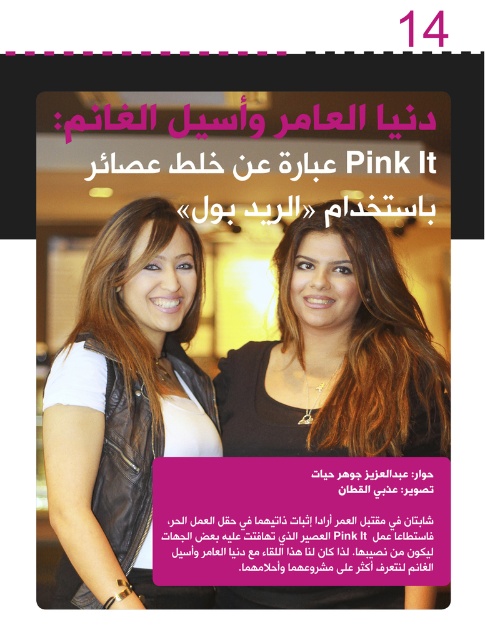
Question: Does leather jacket at center lie in front of matte black vest at center?

Choices:
 (A) no
 (B) yes

Answer: (B)

Question: Does leather jacket at center appear over pink matte text at center?

Choices:
 (A) no
 (B) yes

Answer: (B)

Question: Which point is farther to the camera?

Choices:
 (A) pink matte text at center
 (B) matte black vest at center
 (C) leather jacket at center

Answer: (B)

Question: Is leather jacket at center positioned behind pink matte text at center?

Choices:
 (A) yes
 (B) no

Answer: (B)

Question: Which object is positioned closest to the matte black vest at center?

Choices:
 (A) leather jacket at center
 (B) pink matte text at center

Answer: (B)

Question: Which of these objects is positioned closest to the matte black vest at center?

Choices:
 (A) leather jacket at center
 (B) pink matte text at center

Answer: (B)